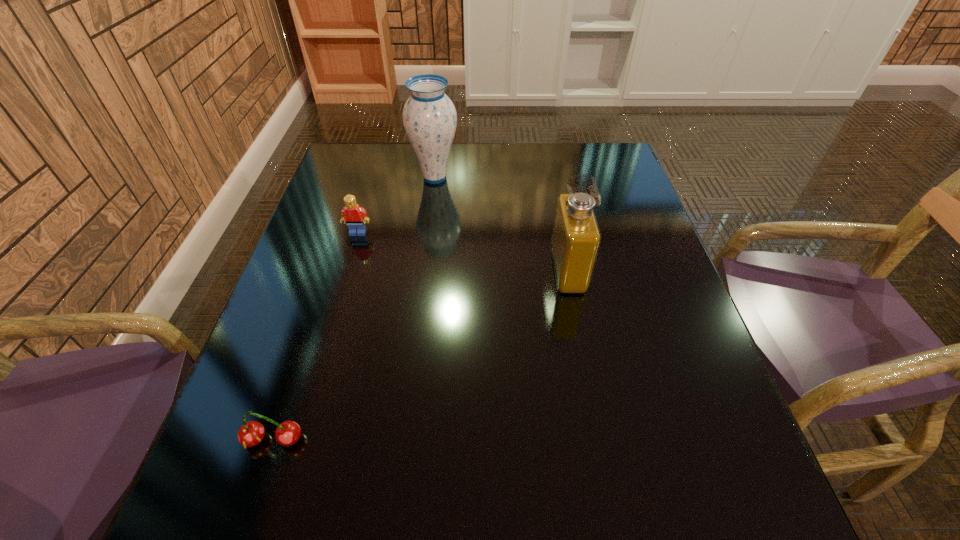
Image resolution: width=960 pixels, height=540 pixels. In the image, there is a desktop. What are the coordinates of `vacant space at the far right corner` in the screenshot? It's located at (574, 143).

Find the location of a particular element. free space between the perfume and the farthest object is located at coordinates (501, 224).

You are a GUI agent. You are given a task and a screenshot of the screen. Output one action in this format:
    pyautogui.click(x=<x>, y=<y>)
    Task: Click on the vacant point located between the shortest object and the rightmost object
    Image resolution: width=960 pixels, height=540 pixels.
    Given the screenshot: What is the action you would take?
    pyautogui.click(x=420, y=355)

Locate an element on the screen. vacant region between the second object from right to left and the shortest object is located at coordinates (354, 309).

The image size is (960, 540). What are the coordinates of `vacant area between the shortest object and the vase` in the screenshot? It's located at (354, 309).

Identify the location of free area in between the farthest object and the shortest object. This screenshot has height=540, width=960. click(x=354, y=309).

The width and height of the screenshot is (960, 540). Find the location of `empty space that is in between the shortest object and the Lego`. empty space that is in between the shortest object and the Lego is located at coordinates (316, 336).

The width and height of the screenshot is (960, 540). In order to click on blank region between the farthest object and the second nearest object in this screenshot , I will do `click(501, 224)`.

The width and height of the screenshot is (960, 540). I want to click on vacant space that is in between the third nearest object and the nearest object, so click(316, 336).

The image size is (960, 540). Identify the location of free space between the cherry and the third object from left to right. (354, 309).